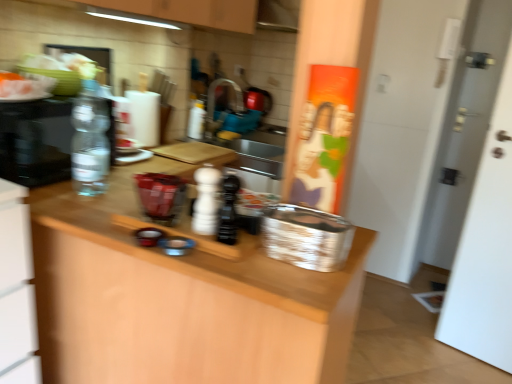
Locate an element on the screen. This screenshot has width=512, height=384. free space in front of transparent plastic bottle at left, acting as the third bottle starting from the front is located at coordinates (79, 205).